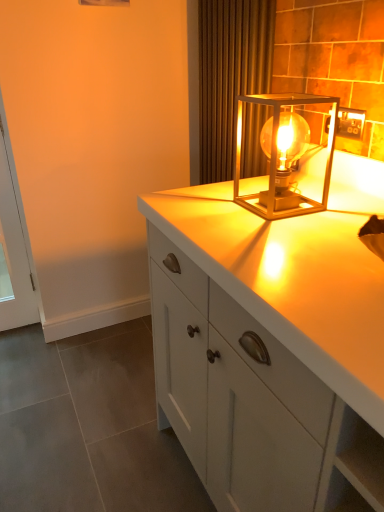
Question: Is brown textured curtain at upper center turned away from metallic gold lamp at upper right?

Choices:
 (A) yes
 (B) no

Answer: (B)

Question: Is brown textured curtain at upper center far from metallic gold lamp at upper right?

Choices:
 (A) yes
 (B) no

Answer: (B)

Question: Does brown textured curtain at upper center have a greater width compared to metallic gold lamp at upper right?

Choices:
 (A) no
 (B) yes

Answer: (A)

Question: Is metallic gold lamp at upper right surrounded by brown textured curtain at upper center?

Choices:
 (A) no
 (B) yes

Answer: (A)

Question: Does brown textured curtain at upper center come in front of metallic gold lamp at upper right?

Choices:
 (A) no
 (B) yes

Answer: (A)

Question: Can we say brown textured curtain at upper center lies outside metallic gold lamp at upper right?

Choices:
 (A) yes
 (B) no

Answer: (A)

Question: Considering the relative sizes of white glossy cabinet at center and metallic gold lamp at upper right in the image provided, is white glossy cabinet at center wider than metallic gold lamp at upper right?

Choices:
 (A) yes
 (B) no

Answer: (A)

Question: Is white glossy cabinet at center to the left of metallic gold lamp at upper right from the viewer's perspective?

Choices:
 (A) yes
 (B) no

Answer: (B)

Question: Is white glossy cabinet at center next to metallic gold lamp at upper right?

Choices:
 (A) yes
 (B) no

Answer: (B)

Question: Considering the relative positions of white glossy cabinet at center and metallic gold lamp at upper right in the image provided, is white glossy cabinet at center to the right of metallic gold lamp at upper right from the viewer's perspective?

Choices:
 (A) yes
 (B) no

Answer: (A)

Question: From a real-world perspective, is white glossy cabinet at center beneath metallic gold lamp at upper right?

Choices:
 (A) no
 (B) yes

Answer: (B)

Question: From the image's perspective, is white glossy cabinet at center located above metallic gold lamp at upper right?

Choices:
 (A) no
 (B) yes

Answer: (A)

Question: Is the position of metallic gold outlet at upper right less distant than that of white glossy cabinet at center?

Choices:
 (A) no
 (B) yes

Answer: (A)